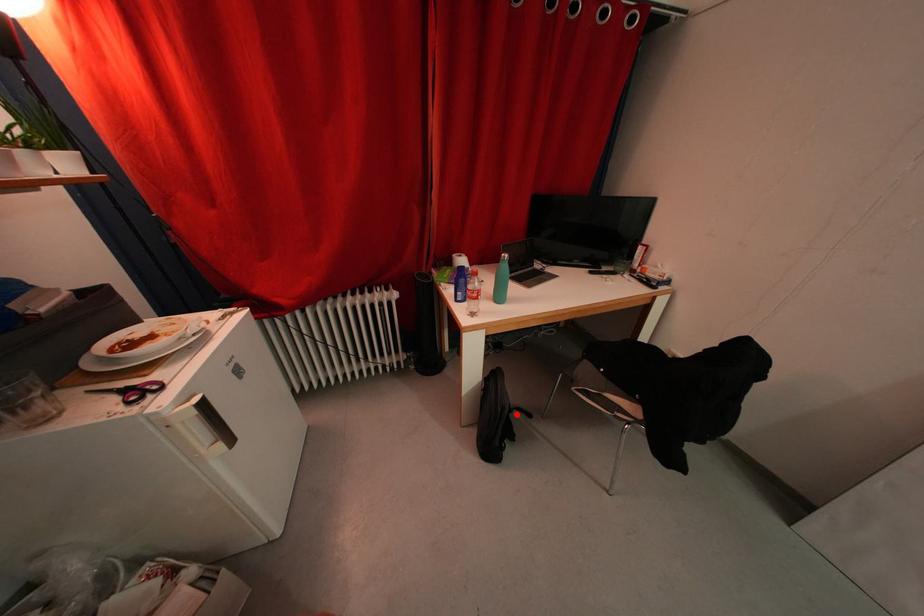
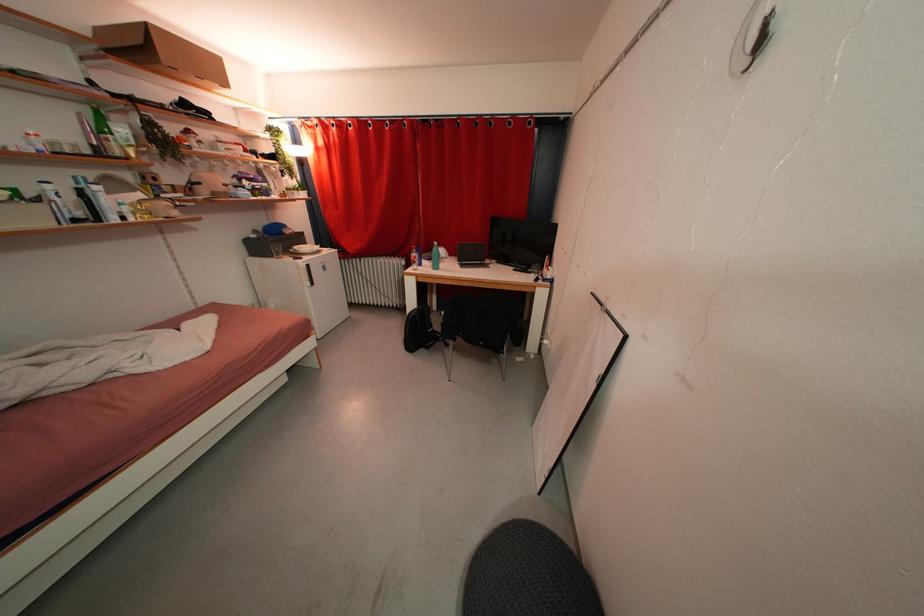
Locate, in the second image, the point that corresponds to the highlighted location in the first image.

(444, 344)